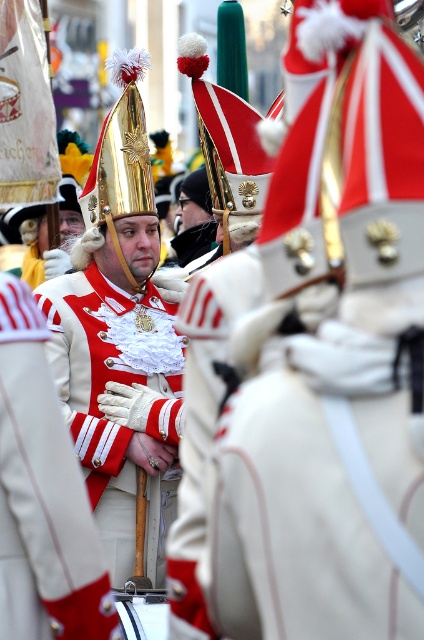
Can you confirm if white matte uniform at center is positioned above white satin uniform at center?

Yes.

Is white matte uniform at center positioned in front of white satin uniform at center?

Yes, white matte uniform at center is in front of white satin uniform at center.

Between point (80, 541) and point (72, 344), which one is positioned in front?

Point (80, 541) is more forward.

Where is `white matte uniform at center`? white matte uniform at center is located at coordinates (42, 496).